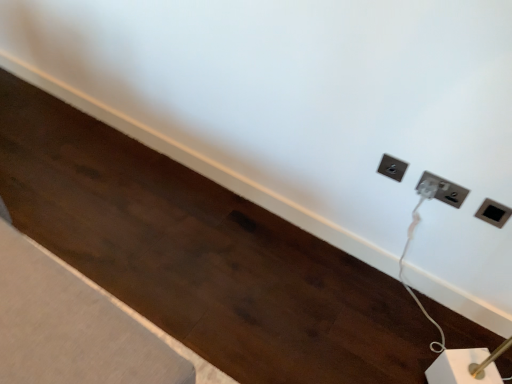
Describe the element at coordinates (392, 167) in the screenshot. The image size is (512, 384). I see `black plastic power plugs and sockets at upper right, arranged as the 1th power plugs and sockets when viewed from the left` at that location.

The image size is (512, 384). What do you see at coordinates (493, 213) in the screenshot? I see `black plastic socket at upper right, the 1th power plugs and sockets from the right` at bounding box center [493, 213].

What do you see at coordinates (446, 190) in the screenshot? I see `white plastic power plug at upper right, placed as the second power plugs and sockets when sorted from right to left` at bounding box center [446, 190].

Find the location of a particular element. The image size is (512, 384). black plastic power plugs and sockets at upper right, marked as the 3th power plugs and sockets in a right-to-left arrangement is located at coordinates (392, 167).

From the image's perspective, between white plastic power plug at upper right, placed as the second power plugs and sockets when sorted from right to left, and black plastic socket at upper right, placed as the third power plugs and sockets when sorted from left to right, who is located below?

black plastic socket at upper right, placed as the third power plugs and sockets when sorted from left to right, is shown below in the image.

Which is less distant, (445, 202) or (497, 217)?

The point (497, 217) is in front.

Do you think white plastic power plug at upper right, placed as the second power plugs and sockets when sorted from right to left, is within black plastic socket at upper right, placed as the third power plugs and sockets when sorted from left to right, or outside of it?

white plastic power plug at upper right, placed as the second power plugs and sockets when sorted from right to left, lies outside black plastic socket at upper right, placed as the third power plugs and sockets when sorted from left to right.

Locate an element on the screen. The image size is (512, 384). power plugs and sockets that is the 1st object located above the black plastic socket at upper right, the 1th power plugs and sockets from the right (from the image's perspective) is located at coordinates (446, 190).

Can you confirm if black plastic power plugs and sockets at upper right, arranged as the 1th power plugs and sockets when viewed from the left, is wider than black plastic socket at upper right, the 1th power plugs and sockets from the right?

Indeed, black plastic power plugs and sockets at upper right, arranged as the 1th power plugs and sockets when viewed from the left, has a greater width compared to black plastic socket at upper right, the 1th power plugs and sockets from the right.

Starting from the black plastic power plugs and sockets at upper right, marked as the 3th power plugs and sockets in a right-to-left arrangement, which power plugs and sockets is the 2nd one to the right? Please provide its 2D coordinates.

[(493, 213)]

Does point (378, 172) appear closer or farther from the camera than point (492, 207)?

Clearly, point (378, 172) is more distant from the camera than point (492, 207).

From the image's perspective, is black plastic power plugs and sockets at upper right, marked as the 3th power plugs and sockets in a right-to-left arrangement, above or below black plastic socket at upper right, placed as the third power plugs and sockets when sorted from left to right?

Clearly, from the image's perspective, black plastic power plugs and sockets at upper right, marked as the 3th power plugs and sockets in a right-to-left arrangement, is above black plastic socket at upper right, placed as the third power plugs and sockets when sorted from left to right.

Which of these two, black plastic socket at upper right, the 1th power plugs and sockets from the right, or white plastic power plug at upper right, placed as the second power plugs and sockets when sorted from right to left, stands shorter?

white plastic power plug at upper right, placed as the second power plugs and sockets when sorted from right to left, is shorter.

From the image's perspective, which is below, black plastic socket at upper right, placed as the third power plugs and sockets when sorted from left to right, or white plastic power plug at upper right, which is the second power plugs and sockets in left-to-right order?

black plastic socket at upper right, placed as the third power plugs and sockets when sorted from left to right, is shown below in the image.

Considering the relative positions of black plastic socket at upper right, the 1th power plugs and sockets from the right, and white plastic power plug at upper right, placed as the second power plugs and sockets when sorted from right to left, in the image provided, is black plastic socket at upper right, the 1th power plugs and sockets from the right, behind white plastic power plug at upper right, placed as the second power plugs and sockets when sorted from right to left,?

No, black plastic socket at upper right, the 1th power plugs and sockets from the right, is in front of white plastic power plug at upper right, placed as the second power plugs and sockets when sorted from right to left.

Are black plastic socket at upper right, placed as the third power plugs and sockets when sorted from left to right, and white plastic power plug at upper right, placed as the second power plugs and sockets when sorted from right to left, far apart?

No, there isn't a large distance between black plastic socket at upper right, placed as the third power plugs and sockets when sorted from left to right, and white plastic power plug at upper right, placed as the second power plugs and sockets when sorted from right to left.

Considering the sizes of objects white plastic power plug at upper right, which is the second power plugs and sockets in left-to-right order, and black plastic power plugs and sockets at upper right, marked as the 3th power plugs and sockets in a right-to-left arrangement, in the image provided, who is smaller, white plastic power plug at upper right, which is the second power plugs and sockets in left-to-right order, or black plastic power plugs and sockets at upper right, marked as the 3th power plugs and sockets in a right-to-left arrangement,?

white plastic power plug at upper right, which is the second power plugs and sockets in left-to-right order.

Which object is wider, white plastic power plug at upper right, which is the second power plugs and sockets in left-to-right order, or black plastic power plugs and sockets at upper right, arranged as the 1th power plugs and sockets when viewed from the left?

Wider between the two is black plastic power plugs and sockets at upper right, arranged as the 1th power plugs and sockets when viewed from the left.

Between point (426, 178) and point (391, 164), which one is positioned in front?

The point (426, 178) is more forward.

Between black plastic socket at upper right, placed as the third power plugs and sockets when sorted from left to right, and black plastic power plugs and sockets at upper right, arranged as the 1th power plugs and sockets when viewed from the left, which one has more height?

With more height is black plastic socket at upper right, placed as the third power plugs and sockets when sorted from left to right.

Consider the image. Is black plastic socket at upper right, placed as the third power plugs and sockets when sorted from left to right, turned away from black plastic power plugs and sockets at upper right, arranged as the 1th power plugs and sockets when viewed from the left?

No.

Consider the image. From a real-world perspective, is black plastic socket at upper right, the 1th power plugs and sockets from the right, physically below black plastic power plugs and sockets at upper right, marked as the 3th power plugs and sockets in a right-to-left arrangement?

Incorrect, from a real-world perspective, black plastic socket at upper right, the 1th power plugs and sockets from the right, is higher than black plastic power plugs and sockets at upper right, marked as the 3th power plugs and sockets in a right-to-left arrangement.

Based on their positions, is black plastic socket at upper right, the 1th power plugs and sockets from the right, located to the left or right of black plastic power plugs and sockets at upper right, arranged as the 1th power plugs and sockets when viewed from the left?

black plastic socket at upper right, the 1th power plugs and sockets from the right, is positioned on black plastic power plugs and sockets at upper right, arranged as the 1th power plugs and sockets when viewed from the left,'s right side.

Are black plastic power plugs and sockets at upper right, marked as the 3th power plugs and sockets in a right-to-left arrangement, and white plastic power plug at upper right, which is the second power plugs and sockets in left-to-right order, making contact?

No, black plastic power plugs and sockets at upper right, marked as the 3th power plugs and sockets in a right-to-left arrangement, is not with white plastic power plug at upper right, which is the second power plugs and sockets in left-to-right order.

Which is farther from the camera, (394,158) or (467,194)?

The point (394,158) is behind.

From a real-world perspective, is black plastic power plugs and sockets at upper right, arranged as the 1th power plugs and sockets when viewed from the left, positioned over white plastic power plug at upper right, placed as the second power plugs and sockets when sorted from right to left, based on gravity?

Actually, black plastic power plugs and sockets at upper right, arranged as the 1th power plugs and sockets when viewed from the left, is physically below white plastic power plug at upper right, placed as the second power plugs and sockets when sorted from right to left, in the real world.

Find the location of a particular element. The height and width of the screenshot is (384, 512). power plugs and sockets in front of the white plastic power plug at upper right, placed as the second power plugs and sockets when sorted from right to left is located at coordinates (493, 213).

Starting from the black plastic socket at upper right, the 1th power plugs and sockets from the right, which power plugs and sockets is the 2nd one behind? Please provide its 2D coordinates.

[(392, 167)]

When comparing their distances from white plastic power plug at upper right, which is the second power plugs and sockets in left-to-right order, does black plastic socket at upper right, placed as the third power plugs and sockets when sorted from left to right, or black plastic power plugs and sockets at upper right, marked as the 3th power plugs and sockets in a right-to-left arrangement, seem further?

The object further to white plastic power plug at upper right, which is the second power plugs and sockets in left-to-right order, is black plastic power plugs and sockets at upper right, marked as the 3th power plugs and sockets in a right-to-left arrangement.

From the picture: Looking at the image, which one is located closer to white plastic power plug at upper right, placed as the second power plugs and sockets when sorted from right to left, black plastic power plugs and sockets at upper right, marked as the 3th power plugs and sockets in a right-to-left arrangement, or black plastic socket at upper right, placed as the third power plugs and sockets when sorted from left to right?

black plastic socket at upper right, placed as the third power plugs and sockets when sorted from left to right, is positioned closer to the anchor white plastic power plug at upper right, placed as the second power plugs and sockets when sorted from right to left.

Based on their spatial positions, is white plastic power plug at upper right, which is the second power plugs and sockets in left-to-right order, or black plastic socket at upper right, the 1th power plugs and sockets from the right, further from black plastic power plugs and sockets at upper right, marked as the 3th power plugs and sockets in a right-to-left arrangement?

Based on the image, black plastic socket at upper right, the 1th power plugs and sockets from the right, appears to be further to black plastic power plugs and sockets at upper right, marked as the 3th power plugs and sockets in a right-to-left arrangement.

Based on their spatial positions, is black plastic socket at upper right, placed as the third power plugs and sockets when sorted from left to right, or white plastic power plug at upper right, which is the second power plugs and sockets in left-to-right order, closer to black plastic power plugs and sockets at upper right, arranged as the 1th power plugs and sockets when viewed from the left?

white plastic power plug at upper right, which is the second power plugs and sockets in left-to-right order.

From the image, which object appears to be nearer to black plastic socket at upper right, placed as the third power plugs and sockets when sorted from left to right, black plastic power plugs and sockets at upper right, marked as the 3th power plugs and sockets in a right-to-left arrangement, or white plastic power plug at upper right, which is the second power plugs and sockets in left-to-right order?

Based on the image, white plastic power plug at upper right, which is the second power plugs and sockets in left-to-right order, appears to be nearer to black plastic socket at upper right, placed as the third power plugs and sockets when sorted from left to right.

When comparing their distances from black plastic socket at upper right, placed as the third power plugs and sockets when sorted from left to right, does white plastic power plug at upper right, which is the second power plugs and sockets in left-to-right order, or black plastic power plugs and sockets at upper right, arranged as the 1th power plugs and sockets when viewed from the left, seem closer?

white plastic power plug at upper right, which is the second power plugs and sockets in left-to-right order, lies closer to black plastic socket at upper right, placed as the third power plugs and sockets when sorted from left to right, than the other object.

The image size is (512, 384). I want to click on power plugs and sockets between black plastic power plugs and sockets at upper right, marked as the 3th power plugs and sockets in a right-to-left arrangement, and black plastic socket at upper right, the 1th power plugs and sockets from the right, so click(x=446, y=190).